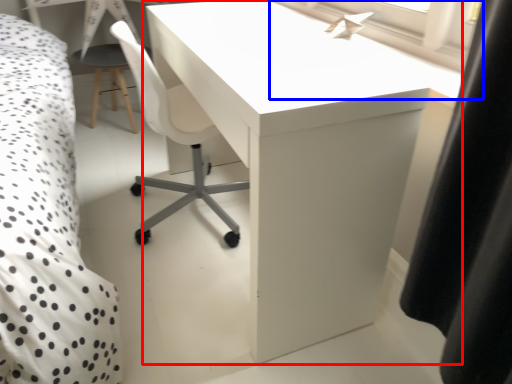
Question: Among these objects, which one is nearest to the camera, table (highlighted by a red box) or window screen (highlighted by a blue box)?

Choices:
 (A) table
 (B) window screen

Answer: (A)